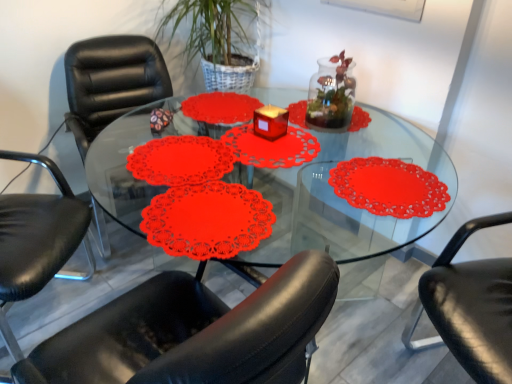
Question: Should I look upward or downward to see black leather chair at left, which is counted as the first chair, starting from the left?

Choices:
 (A) down
 (B) up

Answer: (A)

Question: Should I look upward or downward to see transparent glass table at center?

Choices:
 (A) up
 (B) down

Answer: (B)

Question: Is black leather chair at left, which is the third chair from right to left, located within black leather chair at left, the second chair positioned from the right?

Choices:
 (A) yes
 (B) no

Answer: (B)

Question: Does black leather chair at left, the second chair positioned from the right, have a greater height compared to black leather chair at left, which is counted as the first chair, starting from the left?

Choices:
 (A) no
 (B) yes

Answer: (A)

Question: Can you confirm if black leather chair at left, the second chair when ordered from left to right, is positioned to the left of black leather chair at left, which is counted as the first chair, starting from the left?

Choices:
 (A) no
 (B) yes

Answer: (A)

Question: Would you say black leather chair at left, the second chair positioned from the right, is outside black leather chair at left, which is counted as the first chair, starting from the left?

Choices:
 (A) no
 (B) yes

Answer: (B)

Question: Is black leather chair at left, the second chair when ordered from left to right, smaller than black leather chair at left, which is counted as the first chair, starting from the left?

Choices:
 (A) yes
 (B) no

Answer: (B)

Question: Considering the relative sizes of black leather chair at left, the second chair positioned from the right, and black leather chair at left, which is the third chair from right to left, in the image provided, is black leather chair at left, the second chair positioned from the right, bigger than black leather chair at left, which is the third chair from right to left,?

Choices:
 (A) yes
 (B) no

Answer: (A)

Question: Is transparent glass terrarium at center thinner than black leather chair at left, the second chair when ordered from left to right?

Choices:
 (A) no
 (B) yes

Answer: (B)

Question: Is transparent glass terrarium at center positioned before black leather chair at left, the second chair positioned from the right?

Choices:
 (A) yes
 (B) no

Answer: (B)

Question: Is black leather chair at left, the second chair positioned from the right, completely or partially inside transparent glass terrarium at center?

Choices:
 (A) no
 (B) yes

Answer: (A)

Question: From the image's perspective, would you say transparent glass terrarium at center is positioned over black leather chair at left, the second chair positioned from the right?

Choices:
 (A) no
 (B) yes

Answer: (B)

Question: Is transparent glass terrarium at center located outside black leather chair at left, the second chair when ordered from left to right?

Choices:
 (A) yes
 (B) no

Answer: (A)

Question: From the image's perspective, would you say transparent glass terrarium at center is shown under black leather chair at left, the second chair positioned from the right?

Choices:
 (A) yes
 (B) no

Answer: (B)

Question: Is transparent glass table at center positioned with its back to black leather chair at left, the second chair positioned from the right?

Choices:
 (A) no
 (B) yes

Answer: (B)